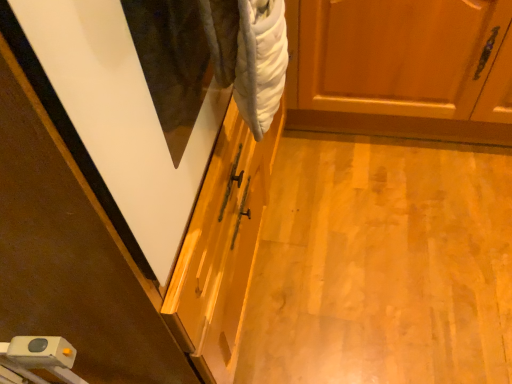
What is the approximate width of wooden cabinet at center?

wooden cabinet at center is 24.77 inches in width.

Describe the element at coordinates (401, 68) in the screenshot. I see `wooden cabinet at center` at that location.

Find the location of a particular element. This screenshot has width=512, height=384. wooden cabinet at center is located at coordinates (401, 68).

Measure the distance between point (293, 3) and camera.

Point (293, 3) and camera are 1.30 meters apart from each other.

Locate an element on the screen. This screenshot has width=512, height=384. wooden cabinet at center is located at coordinates (401, 68).